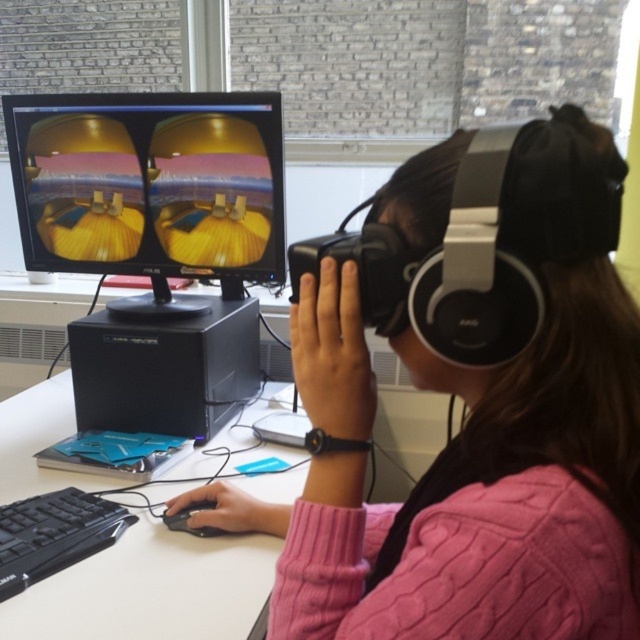
Between point (134, 388) and point (202, 506), which one is positioned in front?

Point (202, 506) is in front.

Can you confirm if black plastic computer at center is positioned above black matte mouse at lower center?

Yes, black plastic computer at center is above black matte mouse at lower center.

Does point (88, 344) come in front of point (186, 529)?

No, it is not.

Find the location of a particular element. The width and height of the screenshot is (640, 640). black plastic computer at center is located at coordinates (164, 369).

Can you confirm if black plastic computer at center is bigger than black plastic keyboard at lower left?

Yes.

Which is below, black plastic computer at center or black plastic keyboard at lower left?

black plastic keyboard at lower left is below.

This screenshot has width=640, height=640. What are the coordinates of `black plastic computer at center` in the screenshot? It's located at (164, 369).

This screenshot has height=640, width=640. What are the coordinates of `black plastic computer at center` in the screenshot? It's located at (164, 369).

Which is above, matte black monitor at center or black plastic keyboard at lower left?

matte black monitor at center

Can you confirm if matte black monitor at center is bigger than black plastic keyboard at lower left?

Yes, matte black monitor at center is bigger than black plastic keyboard at lower left.

Describe the element at coordinates (150, 188) in the screenshot. I see `matte black monitor at center` at that location.

The height and width of the screenshot is (640, 640). I want to click on matte black monitor at center, so click(x=150, y=188).